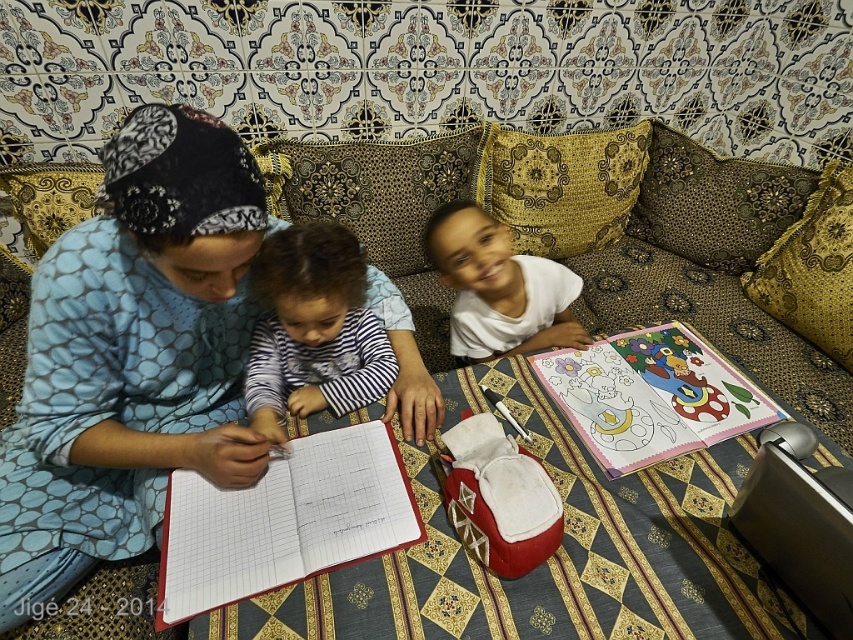
Can you confirm if blue dotted dress at center is positioned to the left of pastel paper coloring book at center?

Correct, you'll find blue dotted dress at center to the left of pastel paper coloring book at center.

Locate an element on the screen. This screenshot has height=640, width=853. blue dotted dress at center is located at coordinates (132, 355).

Is point (50, 600) behind point (643, 396)?

That is False.

Locate an element on the screen. blue dotted dress at center is located at coordinates point(132,355).

Which is in front, point (293, 577) or point (606, 452)?

Point (293, 577) is more forward.

This screenshot has width=853, height=640. What are the coordinates of `red leather notebook at center` in the screenshot? It's located at (283, 520).

This screenshot has width=853, height=640. What do you see at coordinates (283, 520) in the screenshot?
I see `red leather notebook at center` at bounding box center [283, 520].

This screenshot has width=853, height=640. Identify the location of red leather notebook at center. (283, 520).

Which is in front, point (28, 577) or point (297, 401)?

Positioned in front is point (28, 577).

Which of these two, blue dotted dress at center or striped fabric shirt at center, stands shorter?

With less height is striped fabric shirt at center.

Does point (61, 314) lie in front of point (281, 241)?

Yes, point (61, 314) is closer to viewer.

Identify the location of blue dotted dress at center. The height and width of the screenshot is (640, 853). (132, 355).